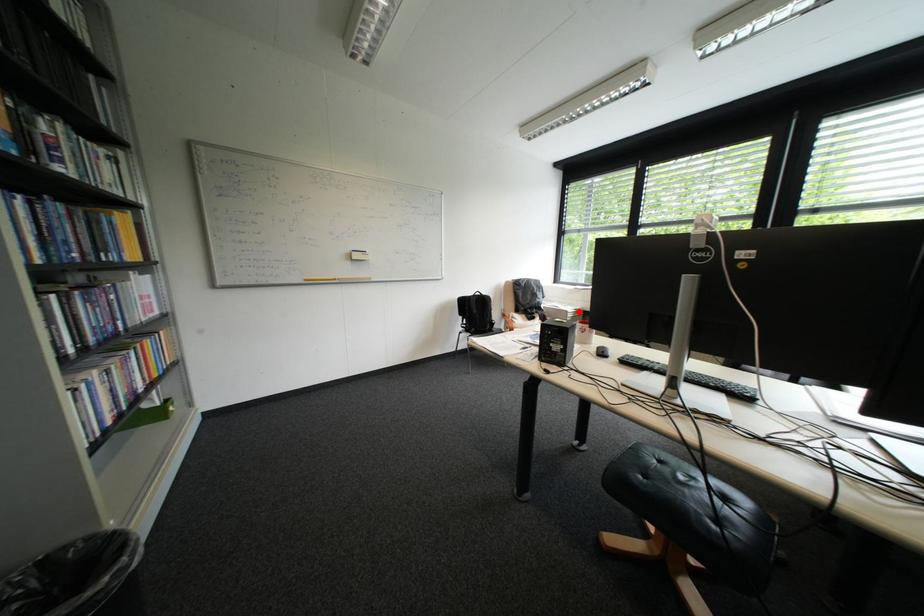
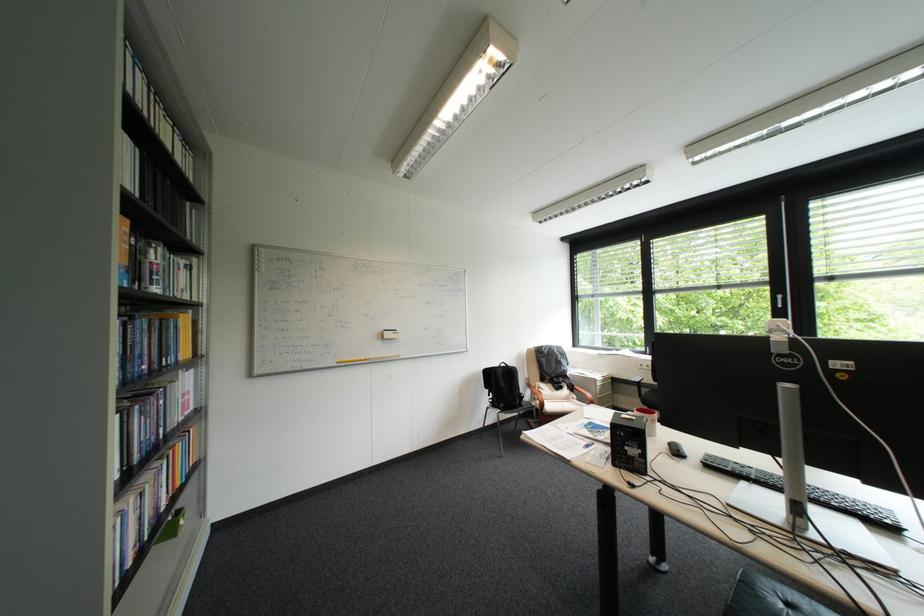
Locate, in the second image, the point that corresponds to the highlighted location in the first image.

(608, 379)